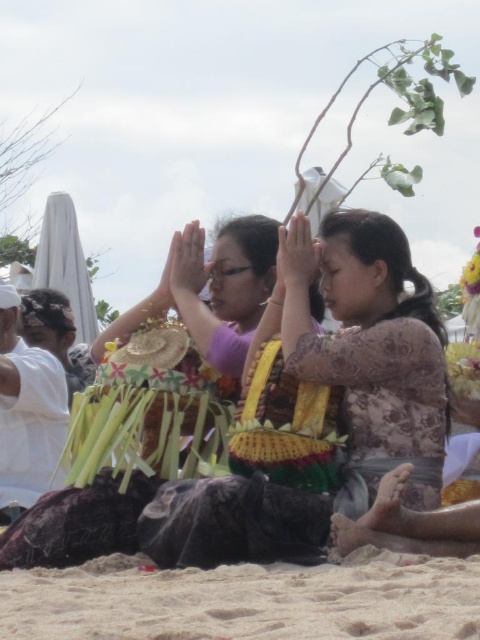
You are standing at the edge of the sandy beach at lower center and want to walk towards the patterned silk dress at center. Which direction should you move to reach it?

You should move forward because the sandy beach at lower center is in front of the patterned silk dress at center, meaning the dress is behind the beach area from your current position.

You are standing at the point labeled as point (245,600) in the image. What is the terrain you are currently standing on?

The terrain at point (245,600) is sandy beach at lower center.